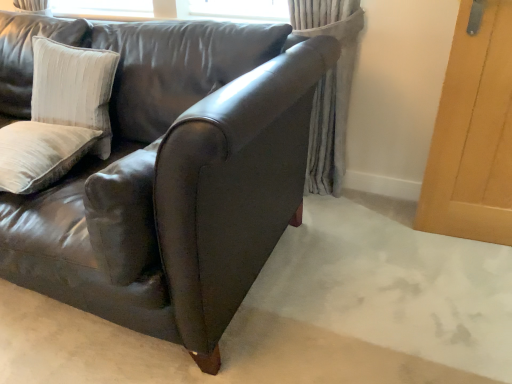
This screenshot has width=512, height=384. What do you see at coordinates (177, 181) in the screenshot?
I see `shiny leather couch at center` at bounding box center [177, 181].

Image resolution: width=512 pixels, height=384 pixels. I want to click on gray textured curtain at center, so click(x=329, y=88).

At what (x,y) coordinates should I click in order to perform the action: click on shiny leather couch at center. Please return your answer as a coordinate pair (x, y). The image size is (512, 384). Looking at the image, I should click on (177, 181).

Which object is closer to the camera, gray textured curtain at center or beige velvet pillow at left, which appears as the 2th pillow when viewed from the top?

Positioned in front is beige velvet pillow at left, which appears as the 2th pillow when viewed from the top.

Is gray textured curtain at center facing away from beige velvet pillow at left, marked as the 1th pillow in a bottom-to-top arrangement?

No, beige velvet pillow at left, marked as the 1th pillow in a bottom-to-top arrangement, is not at the back of gray textured curtain at center.

From the image's perspective, between gray textured curtain at center and beige velvet pillow at left, which appears as the 2th pillow when viewed from the top, who is located below?

beige velvet pillow at left, which appears as the 2th pillow when viewed from the top, is shown below in the image.

Which of these two, velvet beige pillow at upper left, which is counted as the 2th pillow, starting from the bottom, or gray textured curtain at center, is smaller?

velvet beige pillow at upper left, which is counted as the 2th pillow, starting from the bottom.

Looking at this image, from the image's perspective, is velvet beige pillow at upper left, which is the 1th pillow from top to bottom, positioned above or below gray textured curtain at center?

From the image's perspective, velvet beige pillow at upper left, which is the 1th pillow from top to bottom, appears below gray textured curtain at center.

Is velvet beige pillow at upper left, which is counted as the 2th pillow, starting from the bottom, to the left of gray textured curtain at center from the viewer's perspective?

Yes, velvet beige pillow at upper left, which is counted as the 2th pillow, starting from the bottom, is to the left of gray textured curtain at center.

How many degrees apart are the facing directions of velvet beige pillow at upper left, which is the 1th pillow from top to bottom, and shiny leather couch at center?

There is a 0.000274-degree angle between the facing directions of velvet beige pillow at upper left, which is the 1th pillow from top to bottom, and shiny leather couch at center.

Are velvet beige pillow at upper left, which is counted as the 2th pillow, starting from the bottom, and shiny leather couch at center beside each other?

There is a gap between velvet beige pillow at upper left, which is counted as the 2th pillow, starting from the bottom, and shiny leather couch at center.

Between velvet beige pillow at upper left, which is the 1th pillow from top to bottom, and shiny leather couch at center, which one has smaller size?

velvet beige pillow at upper left, which is the 1th pillow from top to bottom.

Which object is positioned more to the left, velvet beige pillow at upper left, which is counted as the 2th pillow, starting from the bottom, or shiny leather couch at center?

shiny leather couch at center.

Which object is thinner, shiny leather couch at center or gray textured curtain at center?

gray textured curtain at center.

Does shiny leather couch at center lie in front of gray textured curtain at center?

That is True.

Does shiny leather couch at center turn towards gray textured curtain at center?

No, shiny leather couch at center is not facing towards gray textured curtain at center.

Which object is positioned more to the right, shiny leather couch at center or gray textured curtain at center?

Positioned to the right is gray textured curtain at center.

Which object is thinner, beige velvet pillow at left, marked as the 1th pillow in a bottom-to-top arrangement, or shiny leather couch at center?

beige velvet pillow at left, marked as the 1th pillow in a bottom-to-top arrangement, is thinner.

Looking at the image, does beige velvet pillow at left, marked as the 1th pillow in a bottom-to-top arrangement, seem bigger or smaller compared to shiny leather couch at center?

Considering their sizes, beige velvet pillow at left, marked as the 1th pillow in a bottom-to-top arrangement, takes up less space than shiny leather couch at center.

Measure the distance from beige velvet pillow at left, marked as the 1th pillow in a bottom-to-top arrangement, to shiny leather couch at center.

beige velvet pillow at left, marked as the 1th pillow in a bottom-to-top arrangement, is 16.39 inches away from shiny leather couch at center.

Which object is further away from the camera taking this photo, beige velvet pillow at left, which appears as the 2th pillow when viewed from the top, or shiny leather couch at center?

Positioned behind is beige velvet pillow at left, which appears as the 2th pillow when viewed from the top.

From the picture: Between gray textured curtain at center and shiny leather couch at center, which one has smaller width?

With smaller width is gray textured curtain at center.

Which object is further away from the camera, gray textured curtain at center or shiny leather couch at center?

gray textured curtain at center is further from the camera.

Who is shorter, gray textured curtain at center or shiny leather couch at center?

shiny leather couch at center is shorter.

Who is smaller, gray textured curtain at center or shiny leather couch at center?

Smaller between the two is gray textured curtain at center.

Where is `the 1st pillow located above the shiny leather couch at center (from a real-world perspective)`? This screenshot has height=384, width=512. the 1st pillow located above the shiny leather couch at center (from a real-world perspective) is located at coordinates (40, 154).

Consider the image. Is shiny leather couch at center next to beige velvet pillow at left, marked as the 1th pillow in a bottom-to-top arrangement?

They are not placed beside each other.

Can you confirm if shiny leather couch at center is taller than beige velvet pillow at left, marked as the 1th pillow in a bottom-to-top arrangement?

Correct, shiny leather couch at center is much taller as beige velvet pillow at left, marked as the 1th pillow in a bottom-to-top arrangement.

In order to click on curtain below the beige velvet pillow at left, which appears as the 2th pillow when viewed from the top (from a real-world perspective) in this screenshot , I will do [x=329, y=88].

There is a gray textured curtain at center. Where is `the 1st pillow below it (from the image's perspective)`? Image resolution: width=512 pixels, height=384 pixels. the 1st pillow below it (from the image's perspective) is located at coordinates (73, 88).

Looking at the image, which one is located closer to gray textured curtain at center, beige velvet pillow at left, which appears as the 2th pillow when viewed from the top, or shiny leather couch at center?

shiny leather couch at center lies closer to gray textured curtain at center than the other object.

Looking at the image, which one is located closer to velvet beige pillow at upper left, which is the 1th pillow from top to bottom, shiny leather couch at center or beige velvet pillow at left, which appears as the 2th pillow when viewed from the top?

Based on the image, beige velvet pillow at left, which appears as the 2th pillow when viewed from the top, appears to be nearer to velvet beige pillow at upper left, which is the 1th pillow from top to bottom.

Based on their spatial positions, is shiny leather couch at center or velvet beige pillow at upper left, which is counted as the 2th pillow, starting from the bottom, further from gray textured curtain at center?

The object further to gray textured curtain at center is velvet beige pillow at upper left, which is counted as the 2th pillow, starting from the bottom.

Based on their spatial positions, is shiny leather couch at center or gray textured curtain at center further from velvet beige pillow at upper left, which is the 1th pillow from top to bottom?

Based on the image, gray textured curtain at center appears to be further to velvet beige pillow at upper left, which is the 1th pillow from top to bottom.

When comparing their distances from shiny leather couch at center, does gray textured curtain at center or beige velvet pillow at left, marked as the 1th pillow in a bottom-to-top arrangement, seem closer?

beige velvet pillow at left, marked as the 1th pillow in a bottom-to-top arrangement.

Estimate the real-world distances between objects in this image. Which object is further from velvet beige pillow at upper left, which is counted as the 2th pillow, starting from the bottom, beige velvet pillow at left, marked as the 1th pillow in a bottom-to-top arrangement, or gray textured curtain at center?

The object further to velvet beige pillow at upper left, which is counted as the 2th pillow, starting from the bottom, is gray textured curtain at center.

Considering their positions, is gray textured curtain at center positioned further to velvet beige pillow at upper left, which is the 1th pillow from top to bottom, than shiny leather couch at center?

gray textured curtain at center.

In the scene shown: Based on their spatial positions, is shiny leather couch at center or velvet beige pillow at upper left, which is the 1th pillow from top to bottom, closer to beige velvet pillow at left, marked as the 1th pillow in a bottom-to-top arrangement?

Based on the image, velvet beige pillow at upper left, which is the 1th pillow from top to bottom, appears to be nearer to beige velvet pillow at left, marked as the 1th pillow in a bottom-to-top arrangement.

The width and height of the screenshot is (512, 384). Identify the location of studio couch between beige velvet pillow at left, which appears as the 2th pillow when viewed from the top, and gray textured curtain at center, in the horizontal direction. (177, 181).

Locate an element on the screen. pillow between shiny leather couch at center and gray textured curtain at center is located at coordinates (73, 88).

At what (x,y) coordinates should I click in order to perform the action: click on pillow between shiny leather couch at center and velvet beige pillow at upper left, which is the 1th pillow from top to bottom, in the front-back direction. Please return your answer as a coordinate pair (x, y). Image resolution: width=512 pixels, height=384 pixels. Looking at the image, I should click on (40, 154).

I want to click on pillow between beige velvet pillow at left, which appears as the 2th pillow when viewed from the top, and gray textured curtain at center, so click(x=73, y=88).